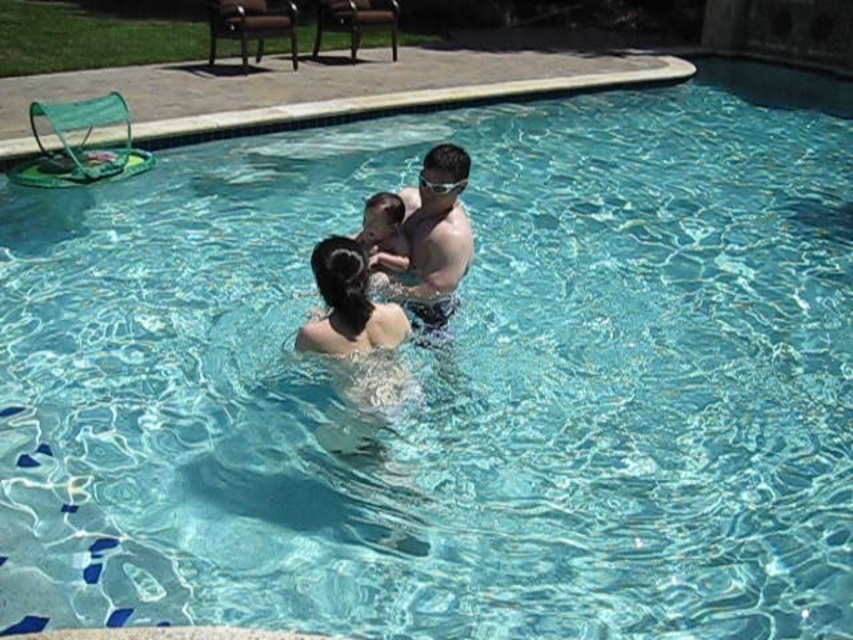
Question: Among these points, which one is farthest from the camera?

Choices:
 (A) (318, 320)
 (B) (399, 244)

Answer: (B)

Question: Which object is the closest to the clear plastic goggles at upper center?

Choices:
 (A) smooth white hair at center
 (B) smooth skin child at center
 (C) smooth skin man at center

Answer: (C)

Question: Which point is farther to the camera?

Choices:
 (A) smooth skin child at center
 (B) smooth white hair at center
 (C) smooth skin man at center

Answer: (A)

Question: Is smooth skin man at center to the left of clear plastic goggles at upper center from the viewer's perspective?

Choices:
 (A) yes
 (B) no

Answer: (A)

Question: Is smooth skin man at center below smooth white hair at center?

Choices:
 (A) yes
 (B) no

Answer: (B)

Question: Does smooth white hair at center have a lesser width compared to smooth skin child at center?

Choices:
 (A) yes
 (B) no

Answer: (B)